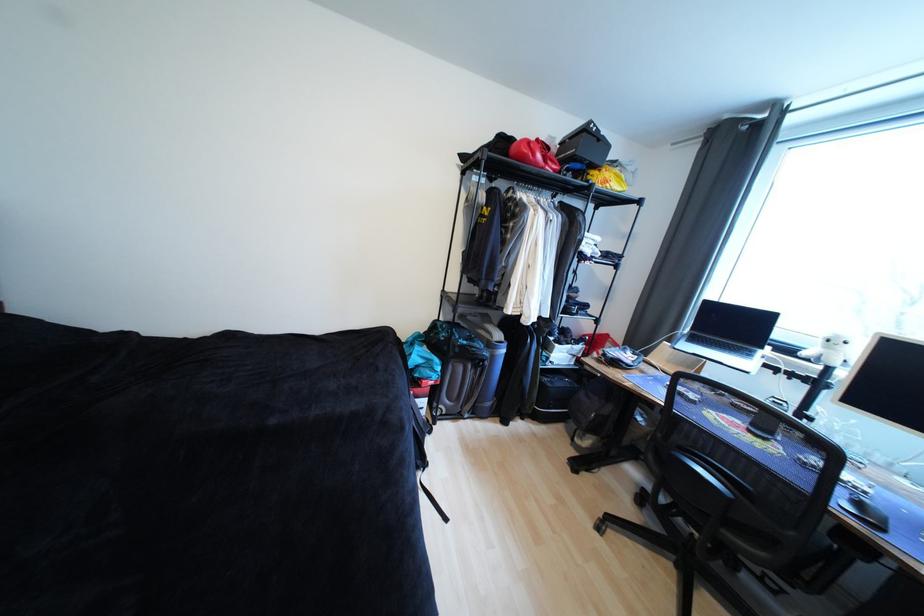
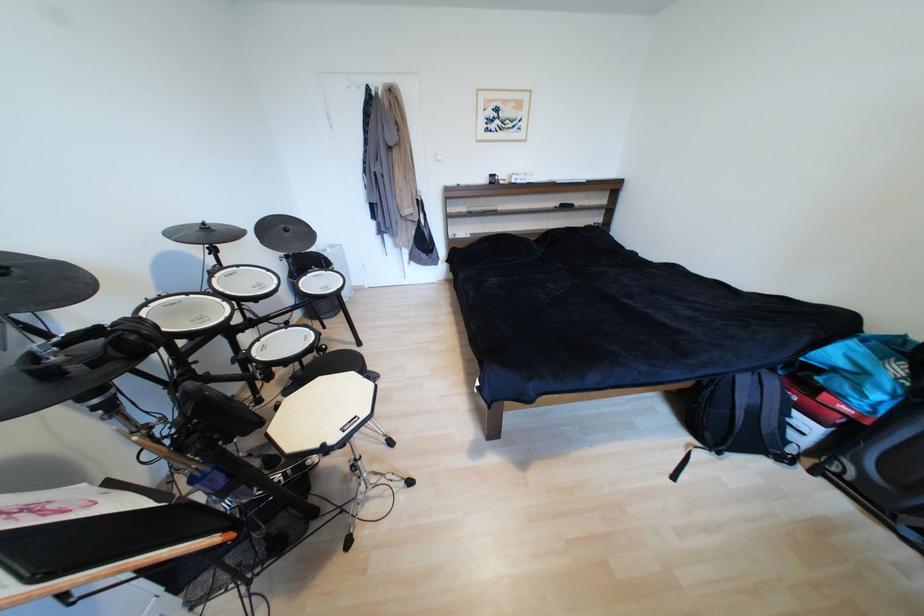
How did the camera likely rotate?

The camera rotated toward left-down.